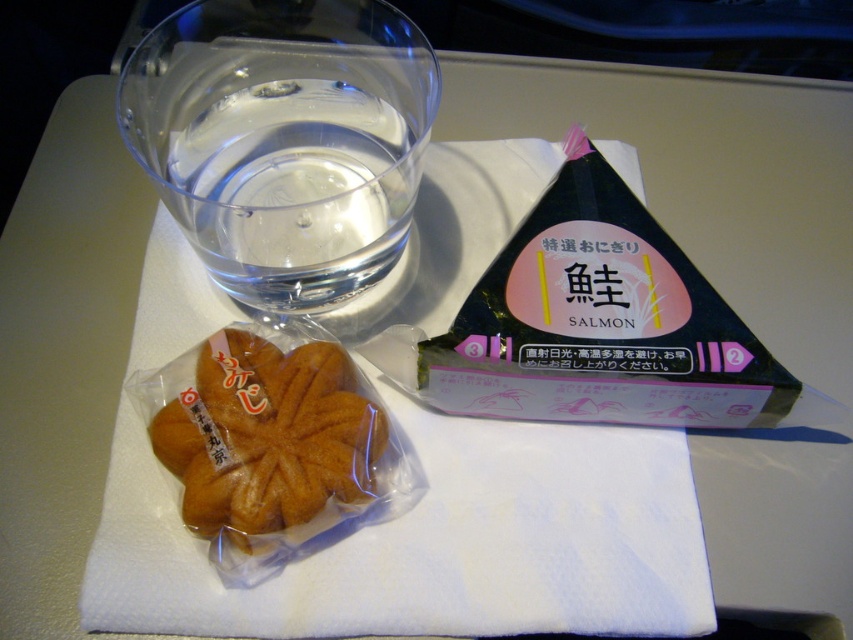
Which is above, black paper triangle at upper right or golden brown pastry at center?

black paper triangle at upper right is higher up.

Is point (753, 378) positioned before point (187, 387)?

Yes, point (753, 378) is in front of point (187, 387).

Locate an element on the screen. This screenshot has width=853, height=640. black paper triangle at upper right is located at coordinates pos(601,323).